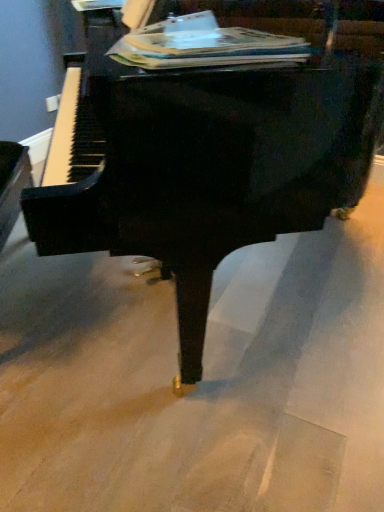
Question: From a real-world perspective, is paperback book at upper center physically below black polished piano at center?

Choices:
 (A) yes
 (B) no

Answer: (B)

Question: From a real-world perspective, is paperback book at upper center on top of black polished piano at center?

Choices:
 (A) no
 (B) yes

Answer: (B)

Question: Considering the relative positions of paperback book at upper center and black polished piano at center in the image provided, is paperback book at upper center to the left of black polished piano at center from the viewer's perspective?

Choices:
 (A) no
 (B) yes

Answer: (B)

Question: Is paperback book at upper center placed right next to black polished piano at center?

Choices:
 (A) yes
 (B) no

Answer: (B)

Question: Considering the relative sizes of paperback book at upper center and black polished piano at center in the image provided, is paperback book at upper center smaller than black polished piano at center?

Choices:
 (A) yes
 (B) no

Answer: (A)

Question: Is black polished piano at center completely or partially inside paperback book at upper center?

Choices:
 (A) no
 (B) yes

Answer: (A)

Question: Is black polished piano at center aimed at paperback book at upper center?

Choices:
 (A) no
 (B) yes

Answer: (A)

Question: From the image's perspective, is black polished piano at center over paperback book at upper center?

Choices:
 (A) yes
 (B) no

Answer: (B)

Question: Considering the relative sizes of black polished piano at center and paperback book at upper center in the image provided, is black polished piano at center shorter than paperback book at upper center?

Choices:
 (A) yes
 (B) no

Answer: (B)

Question: Is black polished piano at center to the left of paperback book at upper center from the viewer's perspective?

Choices:
 (A) no
 (B) yes

Answer: (A)

Question: Is black polished piano at center closer to the viewer compared to paperback book at upper center?

Choices:
 (A) yes
 (B) no

Answer: (A)

Question: Is paperback book at upper center located within black polished piano at center?

Choices:
 (A) yes
 (B) no

Answer: (A)

Question: From the image's perspective, is paperback book at upper center above or below black polished piano at center?

Choices:
 (A) below
 (B) above

Answer: (B)